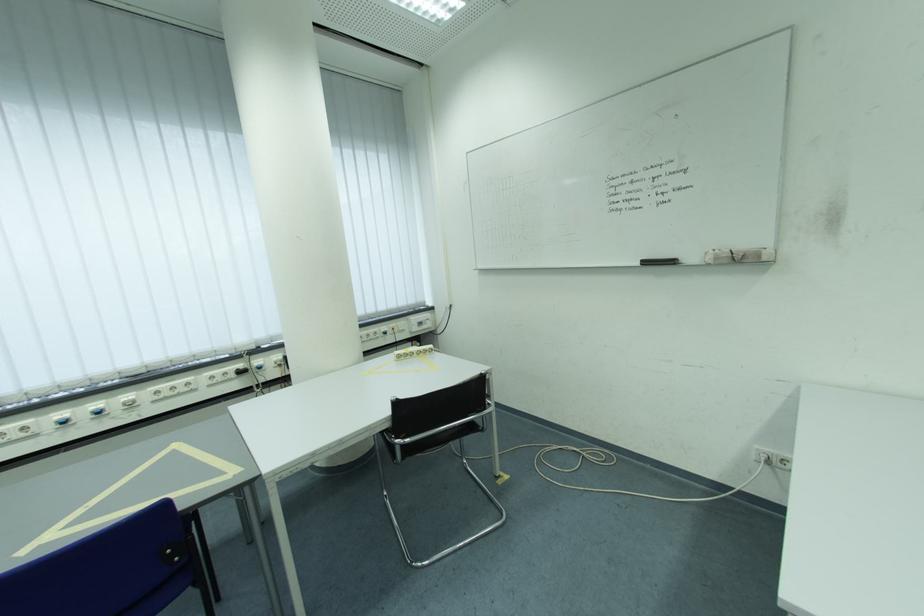
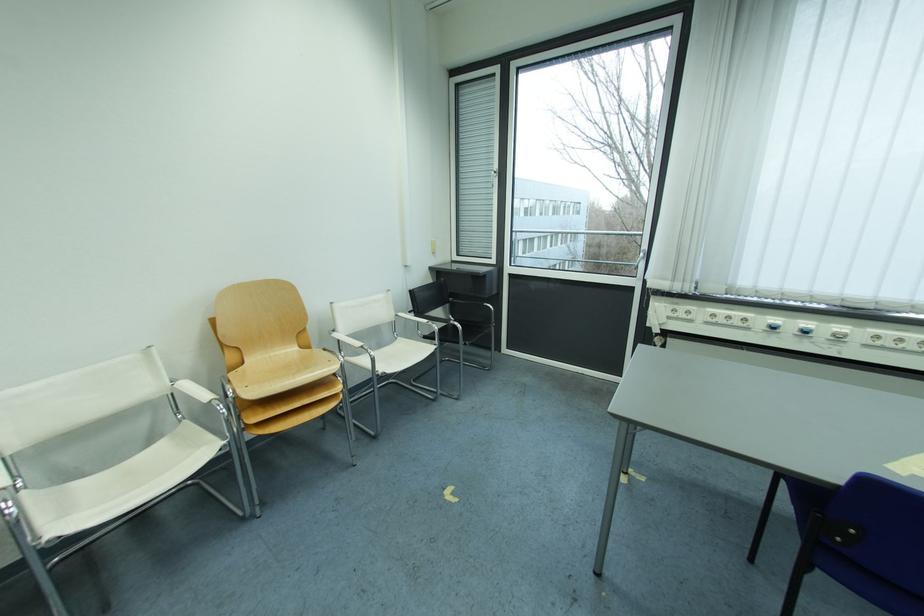
Locate, in the second image, the point that corresponds to pixel 163 403 in the first image.

(874, 347)